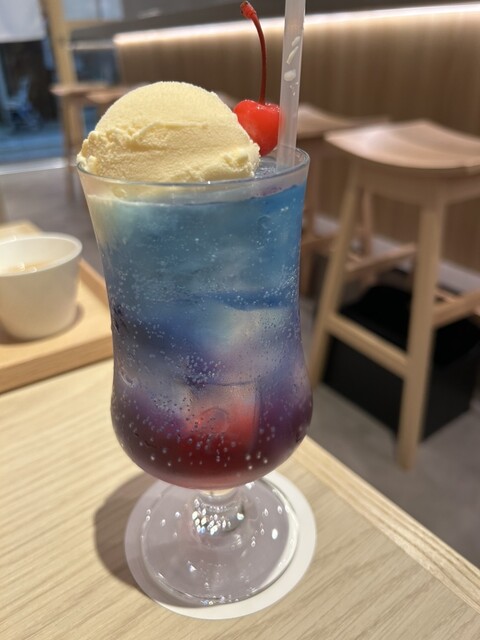
Image resolution: width=480 pixels, height=640 pixels. In order to click on table in this screenshot , I will do `click(49, 547)`.